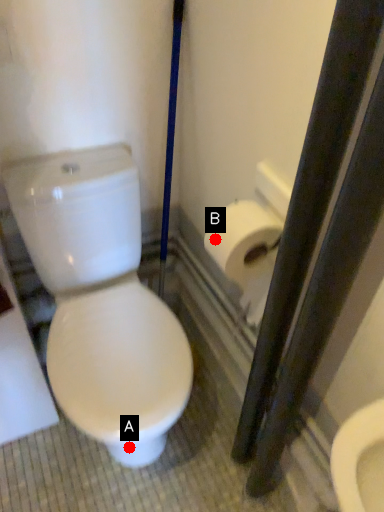
Question: Two points are circled on the image, labeled by A and B beside each circle. Which point is farther from the camera taking this photo?

Choices:
 (A) A is further
 (B) B is further

Answer: (A)